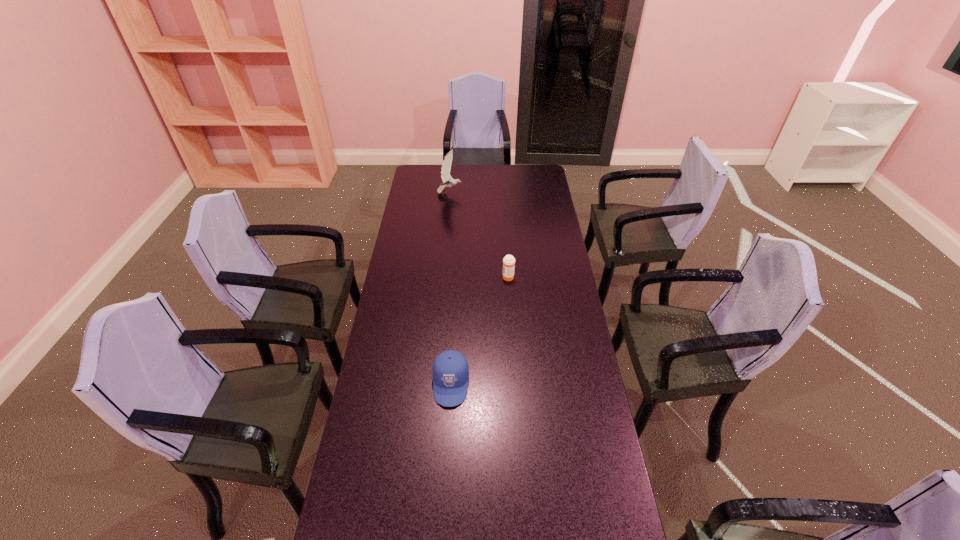
Image resolution: width=960 pixels, height=540 pixels. I want to click on free spot between the gull and the nearest object, so click(x=450, y=289).

The width and height of the screenshot is (960, 540). In order to click on empty location between the nearest object and the medicine in this screenshot , I will do `click(479, 330)`.

Locate which object is the second closest to the farthest object. Please provide its 2D coordinates. Your answer should be formatted as a tuple, i.e. [(x, y)], where the tuple contains the x and y coordinates of a point satisfying the conditions above.

[(450, 369)]

Where is `object that is the second closest one to the cap`? object that is the second closest one to the cap is located at coordinates (448, 181).

Identify the location of free space that satisfies the following two spatial constraints: 1. at the tip of the beak of the farthest object; 2. on the left side of the second farthest object. The image size is (960, 540). (442, 277).